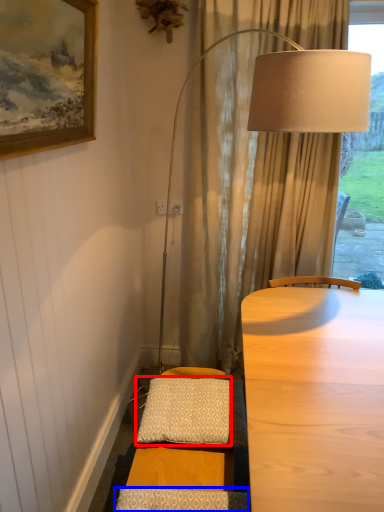
Question: Which object is closer to the camera taking this photo, pillow (highlighted by a red box) or pillow (highlighted by a blue box)?

Choices:
 (A) pillow
 (B) pillow

Answer: (B)